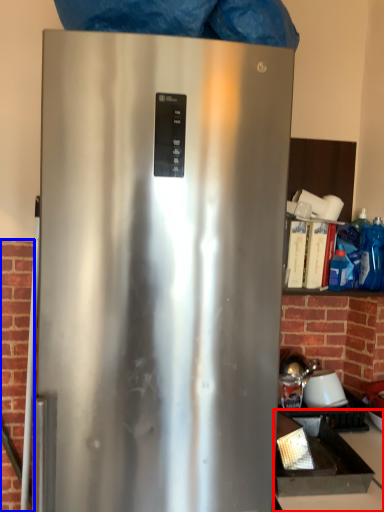
Question: Which object appears closest to the camera in this image, counter top (highlighted by a red box) or brickwork (highlighted by a blue box)?

Choices:
 (A) counter top
 (B) brickwork

Answer: (A)